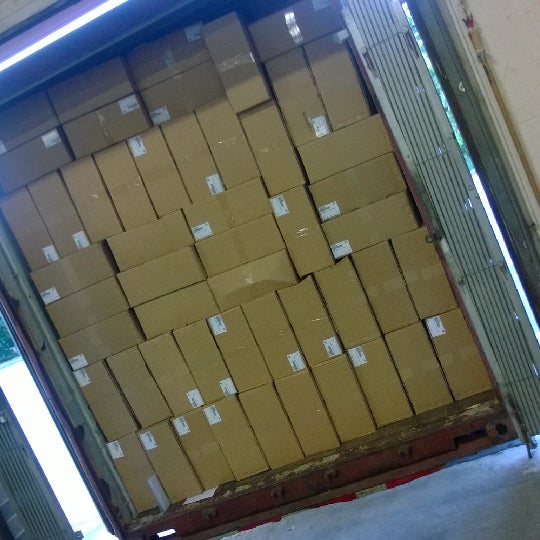
Locate an element on the screen. boxes is located at coordinates (123, 328), (243, 357), (243, 208), (384, 284), (339, 408), (100, 199).